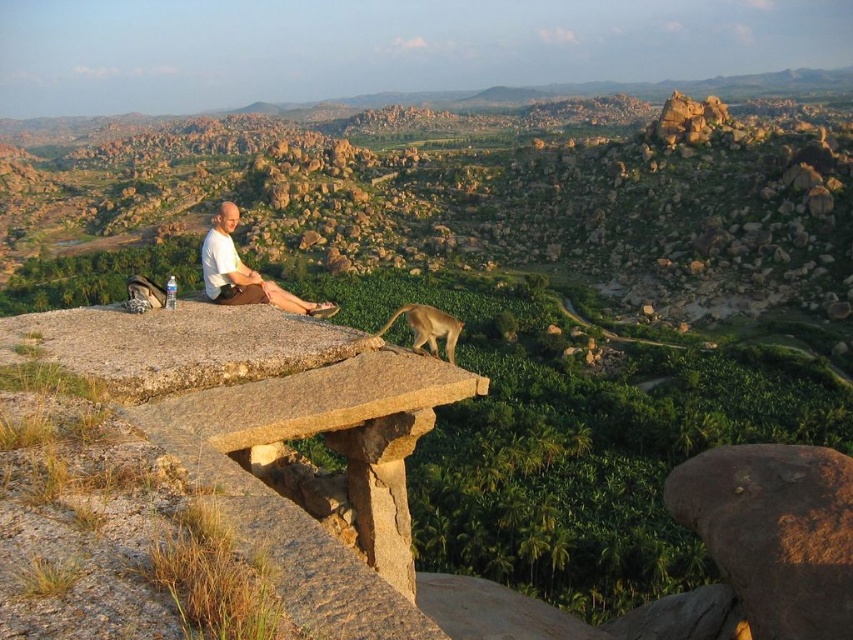
Question: Among these points, which one is nearest to the camera?

Choices:
 (A) (202, 244)
 (B) (792, 560)

Answer: (B)

Question: Which of the following is the farthest from the observer?

Choices:
 (A) golden fur monkey at center
 (B) brown rough stone at lower right
 (C) white matte shirt at center

Answer: (C)

Question: Does brown rough stone at lower right appear under white matte shirt at center?

Choices:
 (A) yes
 (B) no

Answer: (A)

Question: Considering the real-world distances, which object is closest to the brown rough stone at lower right?

Choices:
 (A) golden fur monkey at center
 (B) white matte shirt at center

Answer: (A)

Question: Is brown rough stone at lower right to the right of golden fur monkey at center from the viewer's perspective?

Choices:
 (A) no
 (B) yes

Answer: (B)

Question: Does brown rough stone at lower right have a smaller size compared to white matte shirt at center?

Choices:
 (A) no
 (B) yes

Answer: (B)